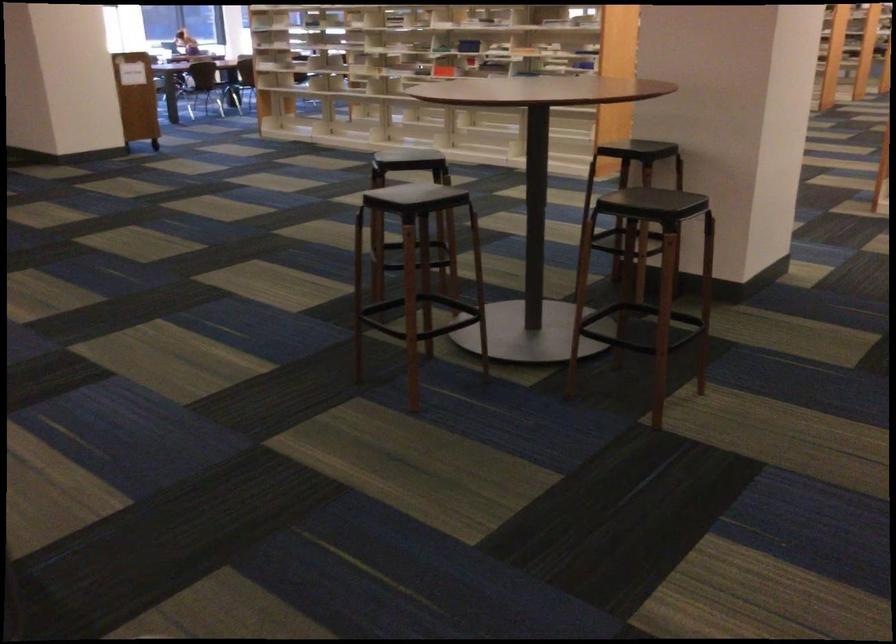
Find where to lift the red book. Please return your answer as a coordinate pair (x, y).

(443, 71)